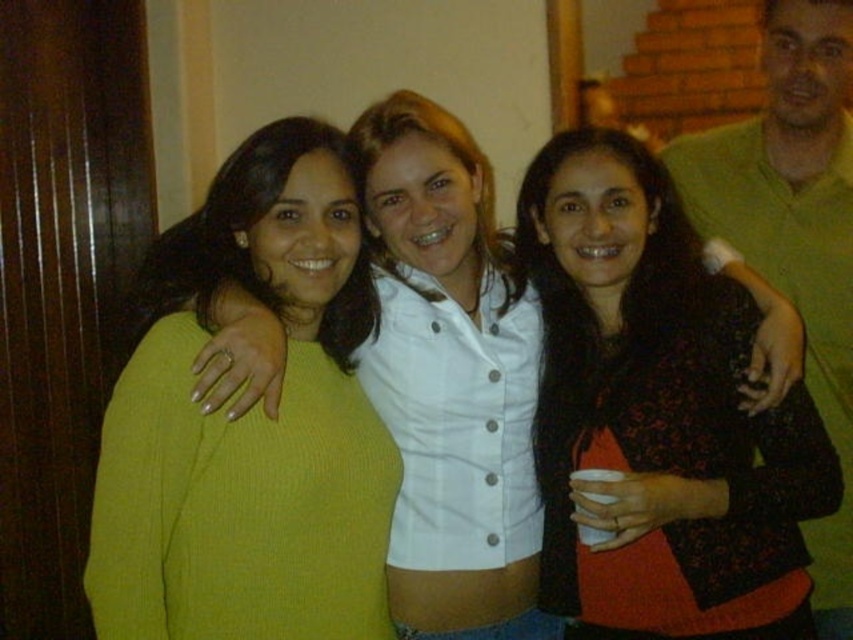
Does point (254, 282) lie in front of point (773, 179)?

Yes, it is.

Does green ribbed sweater at left have a greater height compared to green matte shirt at upper right?

Incorrect, green ribbed sweater at left's height is not larger of green matte shirt at upper right's.

Describe the element at coordinates (248, 424) in the screenshot. I see `green ribbed sweater at left` at that location.

You are a GUI agent. You are given a task and a screenshot of the screen. Output one action in this format:
    pyautogui.click(x=<x>, y=<y>)
    Task: Click on the green ribbed sweater at left
    
    Given the screenshot: What is the action you would take?
    pyautogui.click(x=248, y=424)

Who is more forward, (358,582) or (590,152)?

Point (358,582)

Can you confirm if green ribbed sweater at left is shorter than black textured sweater at center?

Yes, green ribbed sweater at left is shorter than black textured sweater at center.

Which is in front, point (312, 468) or point (659, 582)?

Point (312, 468) is more forward.

Identify the location of green ribbed sweater at left. This screenshot has height=640, width=853. coord(248,424).

Consider the image. Is black textured sweater at center thinner than green matte shirt at upper right?

No.

Between black textured sweater at center and green matte shirt at upper right, which one is positioned lower?

black textured sweater at center is lower down.

At what (x,y) coordinates should I click in order to perform the action: click on black textured sweater at center. Please return your answer as a coordinate pair (x, y). Image resolution: width=853 pixels, height=640 pixels. Looking at the image, I should click on (659, 413).